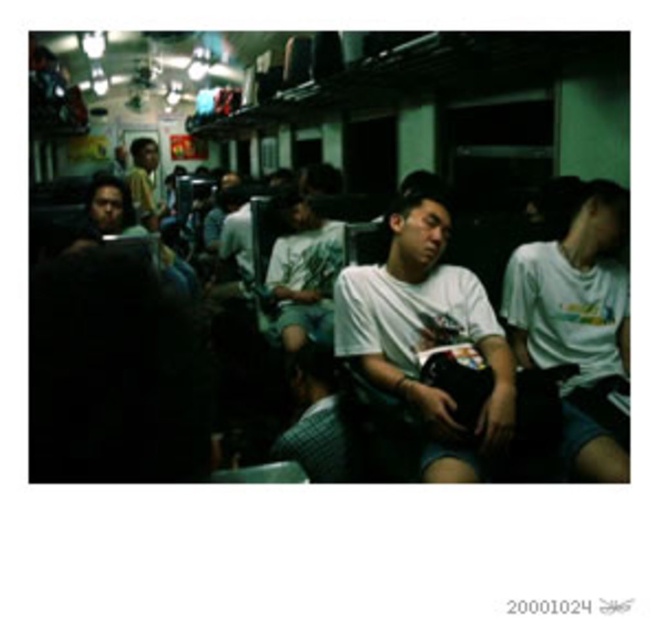
You are standing at the point labeled point (156, 196) and want to move to the point labeled point (484, 339). Is the destination point in front of or behind your current position?

The destination point labeled point (484, 339) is in front of your current position at point (156, 196).